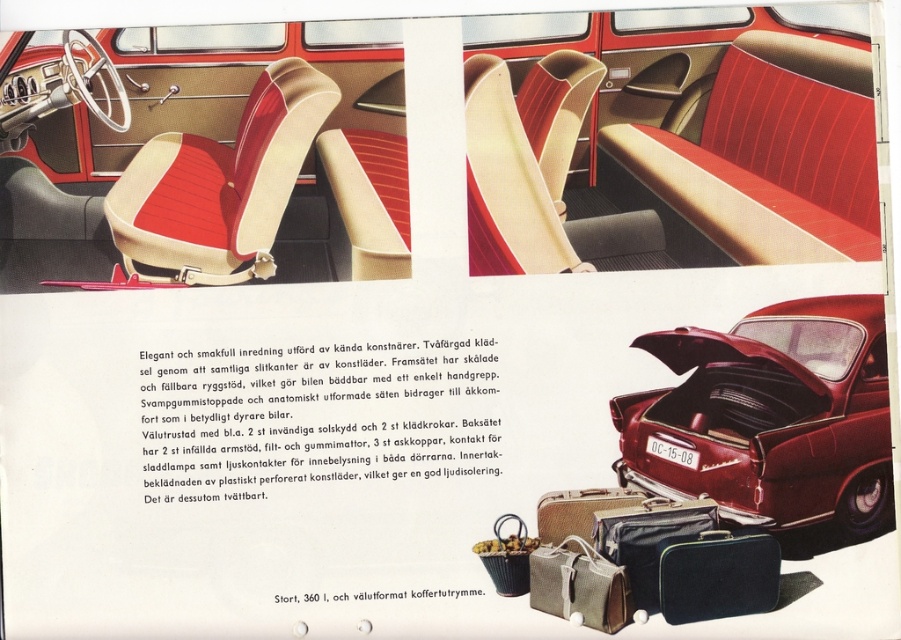
Question: Considering the real-world distances, which object is farthest from the shiny red car trunk at lower right?

Choices:
 (A) textured canvas bag at lower center
 (B) matte black suitcase at lower right
 (C) leather suitcase at lower center
 (D) black fabric suitcase at lower right

Answer: (A)

Question: Is black fabric suitcase at lower right positioned at the back of matte black suitcase at lower right?

Choices:
 (A) yes
 (B) no

Answer: (B)

Question: Which object appears closest to the camera in this image?

Choices:
 (A) shiny red car trunk at lower right
 (B) black fabric suitcase at lower right

Answer: (A)

Question: Which point is closer to the camera?

Choices:
 (A) matte black suitcase at lower right
 (B) shiny red car trunk at lower right
 (C) black fabric suitcase at lower right

Answer: (B)

Question: Is shiny red car trunk at lower right to the left of textured canvas bag at lower center from the viewer's perspective?

Choices:
 (A) no
 (B) yes

Answer: (A)

Question: Is shiny red car trunk at lower right above leather suitcase at lower center?

Choices:
 (A) yes
 (B) no

Answer: (A)